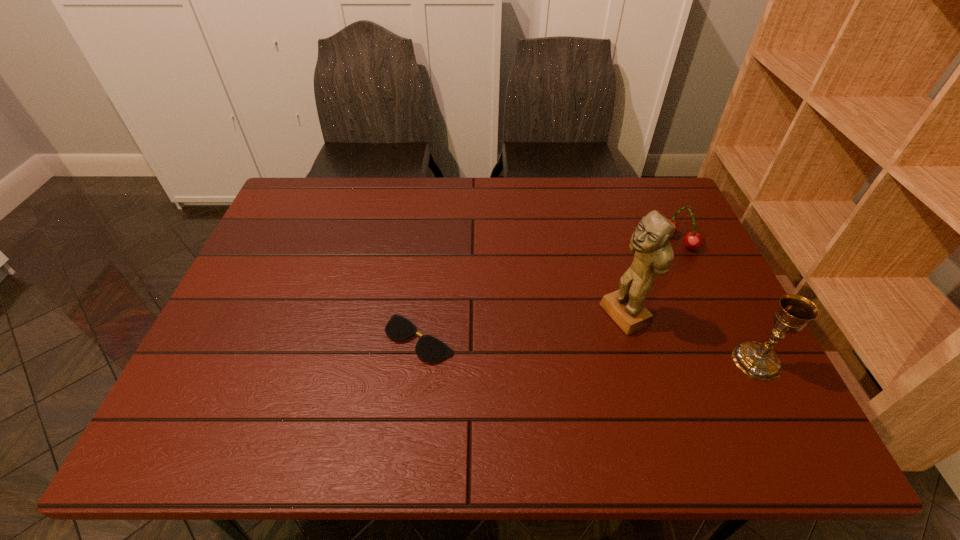
The height and width of the screenshot is (540, 960). In order to click on vacant space that is in between the second tallest object and the farthest object in this screenshot , I will do `click(717, 301)`.

Find the location of a particular element. free space between the leftmost object and the second tallest object is located at coordinates (588, 350).

Find the location of `free point between the figurine and the chalice`. free point between the figurine and the chalice is located at coordinates (690, 338).

Locate an element on the screen. The height and width of the screenshot is (540, 960). vacant space in between the chalice and the spectacles is located at coordinates (588, 350).

Select which object appears as the closest to the third tallest object. Please provide its 2D coordinates. Your answer should be formatted as a tuple, i.e. [(x, y)], where the tuple contains the x and y coordinates of a point satisfying the conditions above.

[(654, 254)]

Select which object appears as the closest to the shortest object. Please provide its 2D coordinates. Your answer should be formatted as a tuple, i.e. [(x, y)], where the tuple contains the x and y coordinates of a point satisfying the conditions above.

[(654, 254)]

The width and height of the screenshot is (960, 540). I want to click on blank area in the image that satisfies the following two spatial constraints: 1. on the back side of the figurine; 2. on the left side of the shortest object, so click(422, 315).

In order to click on vacant space that satisfies the following two spatial constraints: 1. on the back side of the spectacles; 2. on the left side of the farthest object in this screenshot , I will do `click(431, 241)`.

Where is `free space that satisfies the following two spatial constraints: 1. on the back side of the tallest object; 2. on the left side of the farthest object`? This screenshot has height=540, width=960. free space that satisfies the following two spatial constraints: 1. on the back side of the tallest object; 2. on the left side of the farthest object is located at coordinates (603, 241).